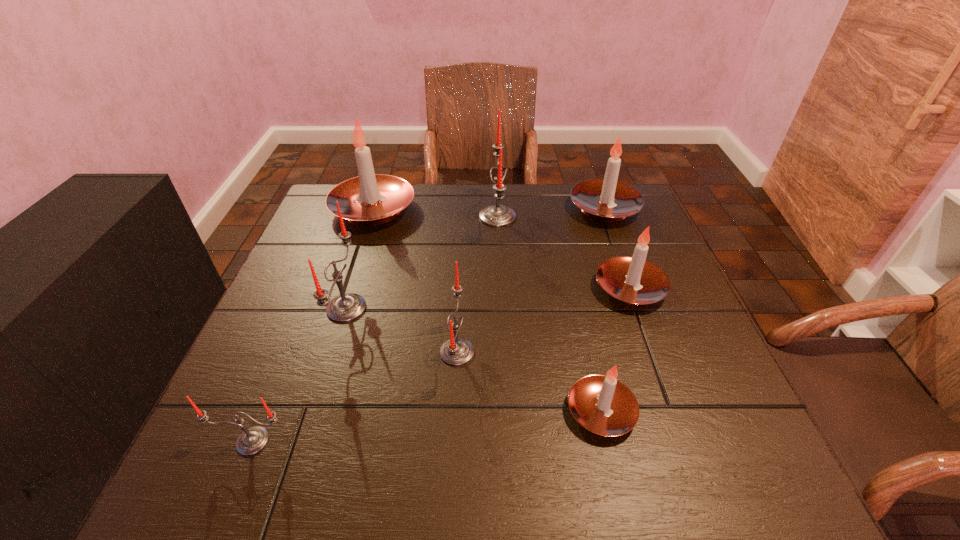
What are the coordinates of `the second closest red candle relative to the biggest white candle` in the screenshot? It's located at (497, 215).

Locate an element on the screen. The height and width of the screenshot is (540, 960). red candle that is the third closest one to the second smallest white candle is located at coordinates (346, 307).

Locate an element on the screen. free location that satisfies the following two spatial constraints: 1. on the front-facing side of the second red candle from right to left; 2. on the right side of the smallest white candle is located at coordinates (454, 411).

This screenshot has height=540, width=960. I want to click on vacant point that satisfies the following two spatial constraints: 1. on the back side of the second biggest white candle; 2. on the left side of the smallest white candle, so click(555, 208).

Locate an element on the screen. The height and width of the screenshot is (540, 960). free space in the image that satisfies the following two spatial constraints: 1. on the back side of the smallest white candle; 2. on the front-facing side of the second biggest red candle is located at coordinates (578, 308).

You are a GUI agent. You are given a task and a screenshot of the screen. Output one action in this format:
    pyautogui.click(x=<x>, y=<y>)
    Task: Click on the free location that satisfies the following two spatial constraints: 1. on the front side of the second nearest white candle; 2. on the front-facing side of the second biggest red candle
    
    Given the screenshot: What is the action you would take?
    636,308